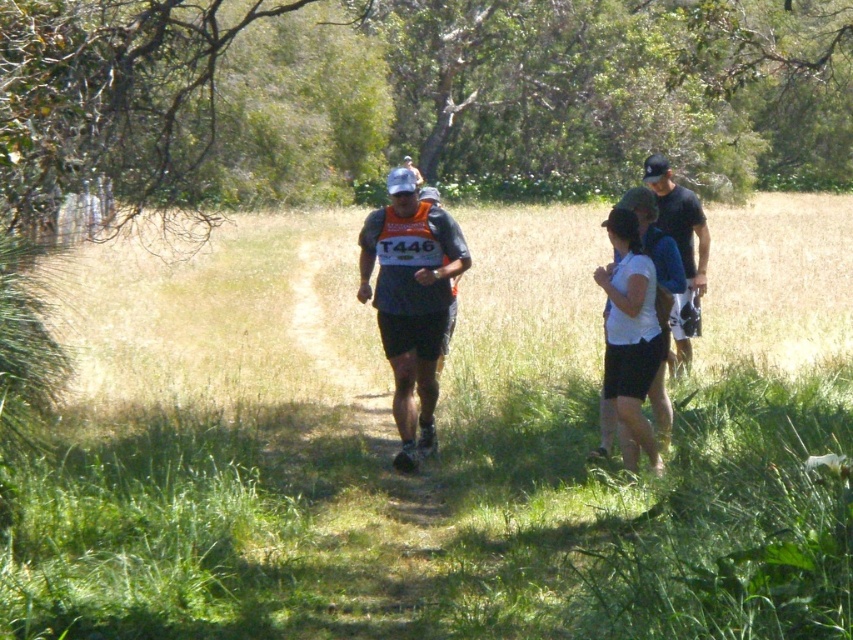
Question: Which point is closer to the camera?

Choices:
 (A) (630, 326)
 (B) (416, 184)
 (C) (695, 273)

Answer: (A)

Question: Which of the following is the closest to the observer?

Choices:
 (A) matte gray shirt at center
 (B) matte gray cap at center
 (C) green grass at center

Answer: (C)

Question: In this image, where is green grass at center located relative to white matte shirt at center?

Choices:
 (A) above
 (B) below

Answer: (A)

Question: Where is green grass at center located in relation to matte gray cap at center in the image?

Choices:
 (A) left
 (B) right

Answer: (B)

Question: Which of the following is the closest to the observer?

Choices:
 (A) click(616, 218)
 (B) click(338, 576)
 (C) click(674, 346)
 (D) click(381, 342)

Answer: (B)

Question: Does matte gray shirt at center have a greater width compared to black fabric shirt at right?

Choices:
 (A) no
 (B) yes

Answer: (A)